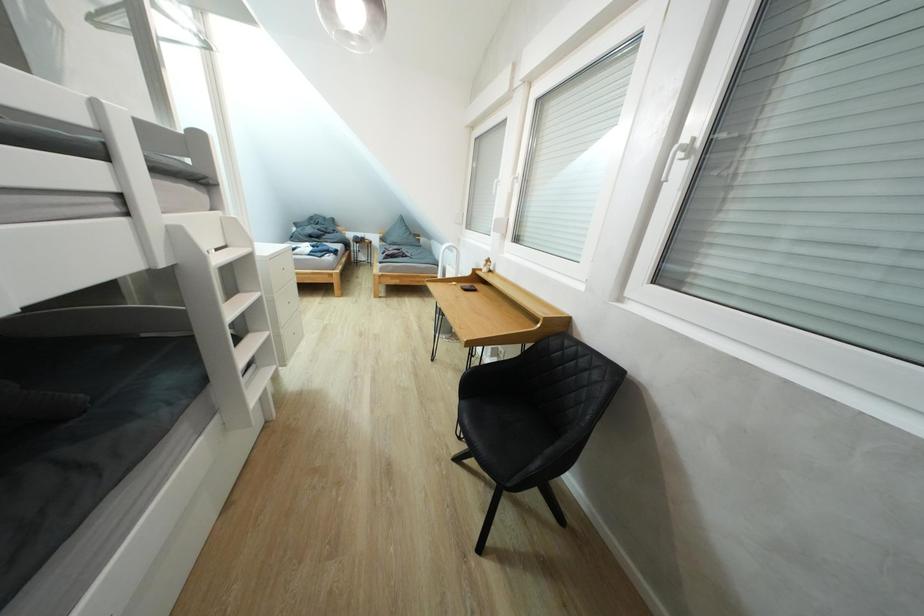
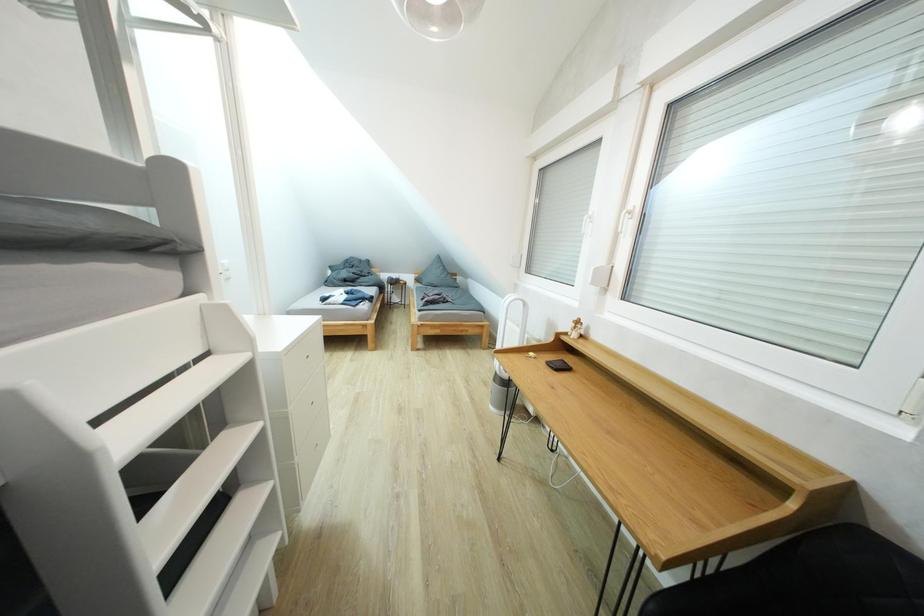
In a continuous first-person perspective shot, in which direction is the camera moving?

The cameraman moved toward left, forward.